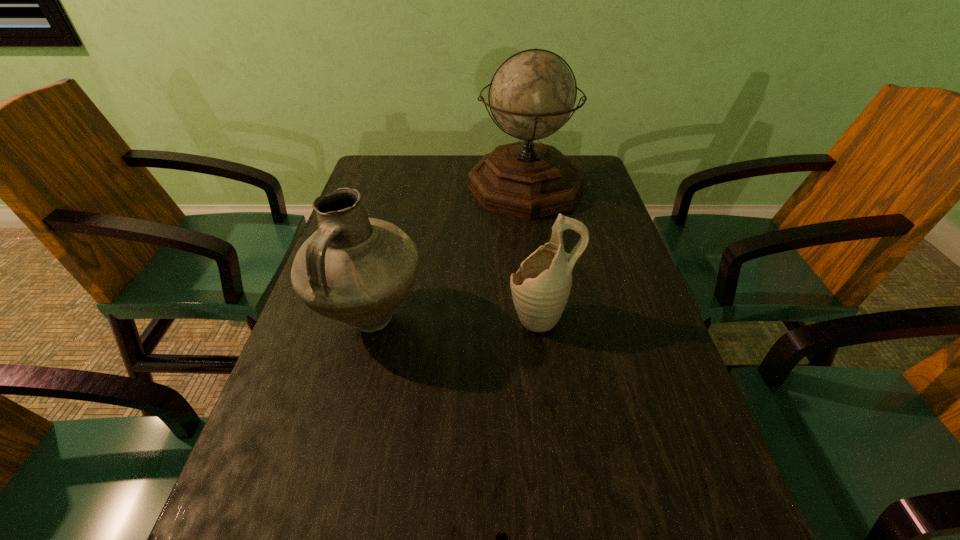
Image resolution: width=960 pixels, height=540 pixels. Identify the location of vacant space that is in between the leftmost object and the shorter pitcher. (455, 318).

The width and height of the screenshot is (960, 540). I want to click on free point between the leftmost object and the second shortest object, so click(455, 318).

Locate an element on the screen. The width and height of the screenshot is (960, 540). free spot between the leftmost object and the shorter pitcher is located at coordinates (455, 318).

Identify the location of object that is the third nearest to the globe. (501, 539).

Select which object is the closest to the third tallest object. Please provide its 2D coordinates. Your answer should be formatted as a tuple, i.e. [(x, y)], where the tuple contains the x and y coordinates of a point satisfying the conditions above.

[(354, 269)]

The height and width of the screenshot is (540, 960). Identify the location of vacant area in the image that satisfies the following two spatial constraints: 1. at the spout of the second shortest object; 2. on the handle side of the second tallest object. (540, 318).

Locate an element on the screen. The height and width of the screenshot is (540, 960). blank space that satisfies the following two spatial constraints: 1. at the spout of the right pitcher; 2. on the handle side of the leftmost object is located at coordinates (540, 318).